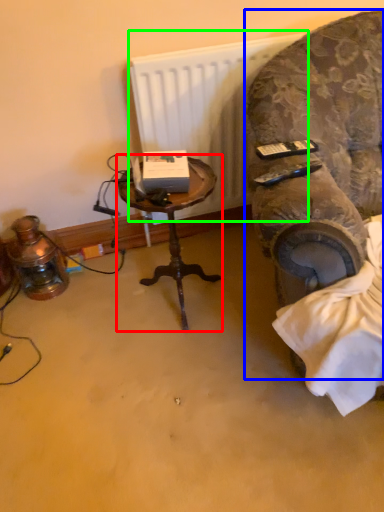
Question: Which object is positioned closest to table (highlighted by a red box)? Select from chair (highlighted by a blue box) and radiator (highlighted by a green box).

Choices:
 (A) chair
 (B) radiator

Answer: (B)